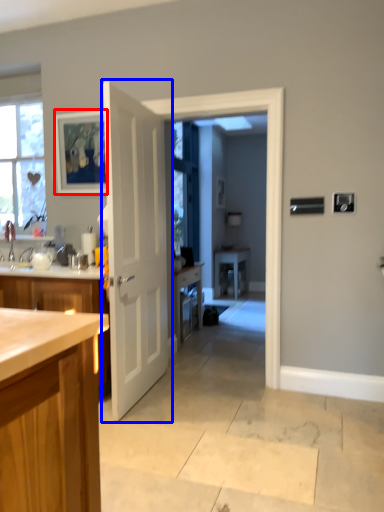
Question: Among these objects, which one is nearest to the camera, picture frame (highlighted by a red box) or door (highlighted by a blue box)?

Choices:
 (A) picture frame
 (B) door

Answer: (B)